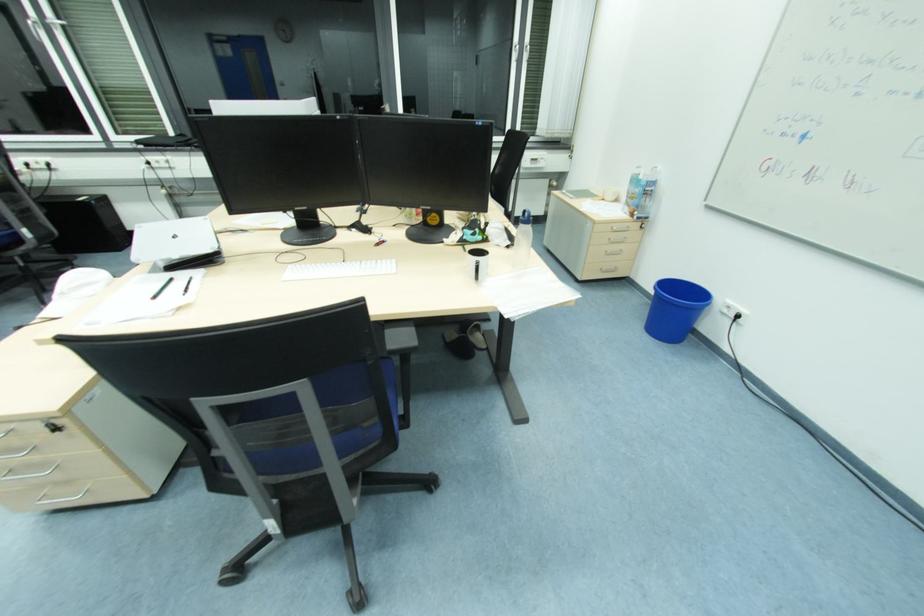
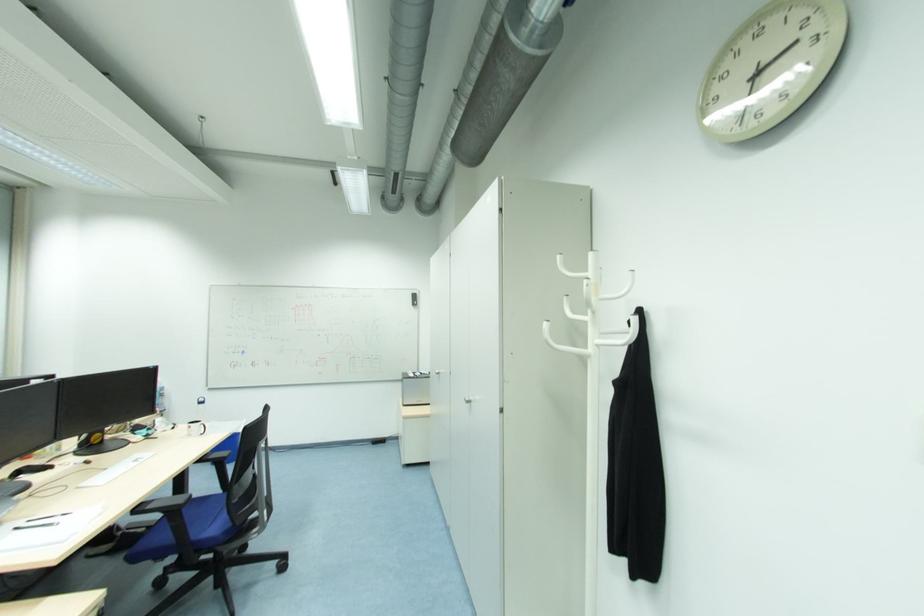
The point at (x=641, y=219) is marked in the first image. Where is the corresponding point in the second image?

(164, 413)